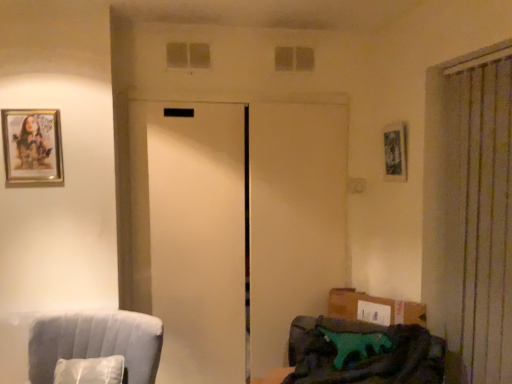
This screenshot has width=512, height=384. What do you see at coordinates (362, 353) in the screenshot?
I see `teal fabric couch at lower right, arranged as the second furniture when viewed from the left` at bounding box center [362, 353].

Image resolution: width=512 pixels, height=384 pixels. Find the location of `teal fabric couch at lower right, arranged as the second furniture when viewed from the left`. teal fabric couch at lower right, arranged as the second furniture when viewed from the left is located at coordinates (362, 353).

Measure the distance from white matte elevator at center to gold-framed picture at upper left, which is the 2th picture frame in back-to-front order.

white matte elevator at center and gold-framed picture at upper left, which is the 2th picture frame in back-to-front order, are 33.66 inches apart.

From the picture: Would you say white matte elevator at center is outside gold-framed picture at upper left, acting as the 1th picture frame starting from the front?

That's correct, white matte elevator at center is outside of gold-framed picture at upper left, acting as the 1th picture frame starting from the front.

From the image's perspective, between white matte elevator at center and gold-framed picture at upper left, acting as the 1th picture frame starting from the front, who is located below?

white matte elevator at center, from the image's perspective.

Considering the positions of objects white matte elevator at center and gold-framed picture at upper left, which is the second picture frame in right-to-left order, in the image provided, who is behind, white matte elevator at center or gold-framed picture at upper left, which is the second picture frame in right-to-left order,?

white matte elevator at center is further from the camera.

Is translucent glass window at upper center, the 1th window in the right-to-left sequence, bigger or smaller than gold-framed picture at upper left, which is the 2th picture frame in back-to-front order?

translucent glass window at upper center, the 1th window in the right-to-left sequence, is smaller than gold-framed picture at upper left, which is the 2th picture frame in back-to-front order.

Can you confirm if translucent glass window at upper center, which is counted as the 2th window, starting from the front, is taller than gold-framed picture at upper left, which is the 2th picture frame in back-to-front order?

In fact, translucent glass window at upper center, which is counted as the 2th window, starting from the front, may be shorter than gold-framed picture at upper left, which is the 2th picture frame in back-to-front order.

Is gold-framed picture at upper left, acting as the 1th picture frame starting from the front, a part of translucent glass window at upper center, positioned as the 2th window in left-to-right order?

Definitely not — gold-framed picture at upper left, acting as the 1th picture frame starting from the front, is not inside translucent glass window at upper center, positioned as the 2th window in left-to-right order.

From a real-world perspective, is white matte elevator at center above or below green fabric pillow at lower right?

From a real-world perspective, white matte elevator at center is physically above green fabric pillow at lower right.

Does white matte elevator at center have a lesser height compared to green fabric pillow at lower right?

No, white matte elevator at center is not shorter than green fabric pillow at lower right.

In terms of size, does white matte elevator at center appear bigger or smaller than green fabric pillow at lower right?

white matte elevator at center is bigger than green fabric pillow at lower right.

Which is more to the right, white matte elevator at center or green fabric pillow at lower right?

green fabric pillow at lower right is more to the right.

From the image's perspective, is velvet blue armchair at lower left, the second furniture from the right, on top of clear glass window at upper center, which is the first window from front to back?

No.

From a real-world perspective, is velvet blue armchair at lower left, arranged as the first furniture when viewed from the left, on top of clear glass window at upper center, which is the 2th window in back-to-front order?

Incorrect, from a real-world perspective, velvet blue armchair at lower left, arranged as the first furniture when viewed from the left, is lower than clear glass window at upper center, which is the 2th window in back-to-front order.

Looking at the image, does velvet blue armchair at lower left, arranged as the first furniture when viewed from the left, seem bigger or smaller compared to clear glass window at upper center, which is the 2th window in back-to-front order?

Considering their sizes, velvet blue armchair at lower left, arranged as the first furniture when viewed from the left, takes up more space than clear glass window at upper center, which is the 2th window in back-to-front order.

Consider the image. Does teal fabric couch at lower right, which ranks as the first furniture in right-to-left order, have a greater width compared to gold-framed picture at upper left, acting as the 1th picture frame starting from the front?

Yes, teal fabric couch at lower right, which ranks as the first furniture in right-to-left order, is wider than gold-framed picture at upper left, acting as the 1th picture frame starting from the front.

Which object is more forward, teal fabric couch at lower right, which ranks as the first furniture in right-to-left order, or gold-framed picture at upper left, which is the second picture frame in right-to-left order?

teal fabric couch at lower right, which ranks as the first furniture in right-to-left order, is in front.

Considering the positions of points (393, 327) and (17, 141), is point (393, 327) closer to camera compared to point (17, 141)?

That is True.

Is velvet blue armchair at lower left, arranged as the first furniture when viewed from the left, turned away from teal fabric couch at lower right, which ranks as the first furniture in right-to-left order?

No, velvet blue armchair at lower left, arranged as the first furniture when viewed from the left, is not facing the opposite direction of teal fabric couch at lower right, which ranks as the first furniture in right-to-left order.

At what (x,y) coordinates should I click in order to perform the action: click on furniture above the teal fabric couch at lower right, which ranks as the first furniture in right-to-left order (from the image's perspective). Please return your answer as a coordinate pair (x, y). This screenshot has width=512, height=384. Looking at the image, I should click on (78, 343).

Considering the relative sizes of velvet blue armchair at lower left, the second furniture from the right, and teal fabric couch at lower right, arranged as the second furniture when viewed from the left, in the image provided, is velvet blue armchair at lower left, the second furniture from the right, shorter than teal fabric couch at lower right, arranged as the second furniture when viewed from the left,?

Indeed, velvet blue armchair at lower left, the second furniture from the right, has a lesser height compared to teal fabric couch at lower right, arranged as the second furniture when viewed from the left.

Is point (198, 62) more distant than point (464, 186)?

Yes, point (198, 62) is behind point (464, 186).

From a real-world perspective, which is physically above, clear glass window at upper center, which is the 2th window in back-to-front order, or white sheer curtain at right?

clear glass window at upper center, which is the 2th window in back-to-front order.

This screenshot has height=384, width=512. I want to click on curtain lying on the right of clear glass window at upper center, which is the 2th window in back-to-front order, so click(x=470, y=213).

From a real-world perspective, which picture frame is the 2nd one above the white matte elevator at center? Please provide its 2D coordinates.

[(32, 146)]

Locate an element on the screen. Image resolution: width=512 pixels, height=384 pixels. the 2nd picture frame positioned below the translucent glass window at upper center, which is the 1th window in back-to-front order (from the image's perspective) is located at coordinates (32, 146).

Based on their spatial positions, is translucent glass window at upper center, positioned as the 2th window in left-to-right order, or white sheer curtain at right further from green fabric pillow at lower right?

translucent glass window at upper center, positioned as the 2th window in left-to-right order, is positioned further to the anchor green fabric pillow at lower right.

Based on their spatial positions, is white matte elevator at center or green fabric pillow at lower right closer to gold-framed picture at upper left, which is the second picture frame in right-to-left order?

white matte elevator at center is positioned closer to the anchor gold-framed picture at upper left, which is the second picture frame in right-to-left order.

Considering their positions, is velvet blue armchair at lower left, the second furniture from the right, positioned further to clear glass window at upper center, which is the 2th window in back-to-front order, than green fabric pillow at lower right?

green fabric pillow at lower right is further to clear glass window at upper center, which is the 2th window in back-to-front order.

From the image, which object appears to be farther from clear glass window at upper center, which is counted as the first window, starting from the left, metallic silver picture frame at upper right, which is the 2th picture frame in left-to-right order, or velvet blue armchair at lower left, the second furniture from the right?

velvet blue armchair at lower left, the second furniture from the right, is positioned further to the anchor clear glass window at upper center, which is counted as the first window, starting from the left.

Based on their spatial positions, is clear glass window at upper center, which is the 2th window in back-to-front order, or white matte elevator at center closer to gold-framed picture at upper left, which is the 2th picture frame in back-to-front order?

clear glass window at upper center, which is the 2th window in back-to-front order.

From the image, which object appears to be nearer to white sheer curtain at right, teal fabric couch at lower right, arranged as the second furniture when viewed from the left, or gold-framed picture at upper left, acting as the 1th picture frame starting from the front?

teal fabric couch at lower right, arranged as the second furniture when viewed from the left, is positioned closer to the anchor white sheer curtain at right.

Considering their positions, is gold-framed picture at upper left, which is the second picture frame in right-to-left order, positioned further to velvet blue armchair at lower left, the second furniture from the right, than teal fabric couch at lower right, arranged as the second furniture when viewed from the left?

Based on the image, teal fabric couch at lower right, arranged as the second furniture when viewed from the left, appears to be further to velvet blue armchair at lower left, the second furniture from the right.

Based on their spatial positions, is gold-framed picture at upper left, which is the second picture frame in right-to-left order, or translucent glass window at upper center, which is the 1th window in back-to-front order, further from clear glass window at upper center, which appears as the 2th window when viewed from the right?

gold-framed picture at upper left, which is the second picture frame in right-to-left order, is further to clear glass window at upper center, which appears as the 2th window when viewed from the right.

In order to click on furniture between gold-framed picture at upper left, which is the 1th picture frame in left-to-right order, and teal fabric couch at lower right, which ranks as the first furniture in right-to-left order in this screenshot , I will do `click(78, 343)`.

This screenshot has height=384, width=512. What are the coordinates of `furniture situated between velvet blue armchair at lower left, arranged as the first furniture when viewed from the left, and white sheer curtain at right from left to right` in the screenshot? It's located at pyautogui.click(x=362, y=353).

Find the location of `elevator between metallic silver picture frame at upper right, the 1th picture frame in the back-to-front sequence, and green fabric pillow at lower right vertically`. elevator between metallic silver picture frame at upper right, the 1th picture frame in the back-to-front sequence, and green fabric pillow at lower right vertically is located at coordinates (234, 228).

I want to click on elevator between translucent glass window at upper center, positioned as the 2th window in left-to-right order, and teal fabric couch at lower right, which ranks as the first furniture in right-to-left order, vertically, so click(234, 228).